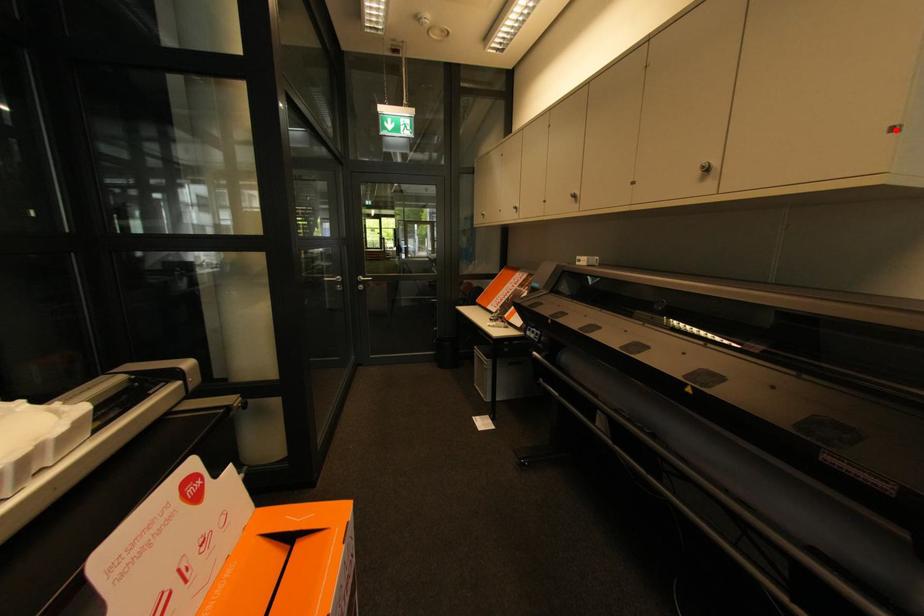
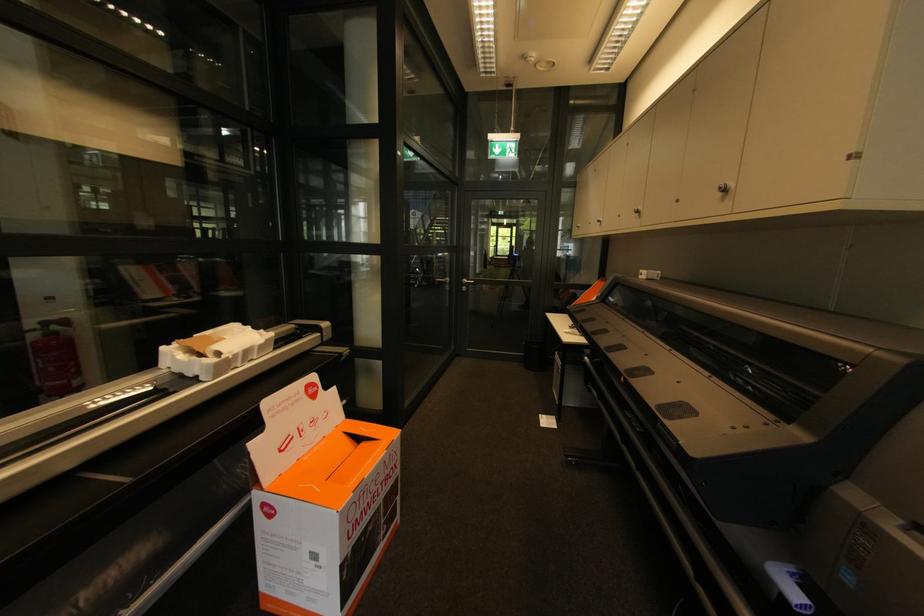
Question: I am providing you with two images of the same scene from different viewpoints. In image1, a red point is highlighted. Considering the same 3D point in image2, which of the following is correct?

Choices:
 (A) It is closer
 (B) It is farther

Answer: (A)